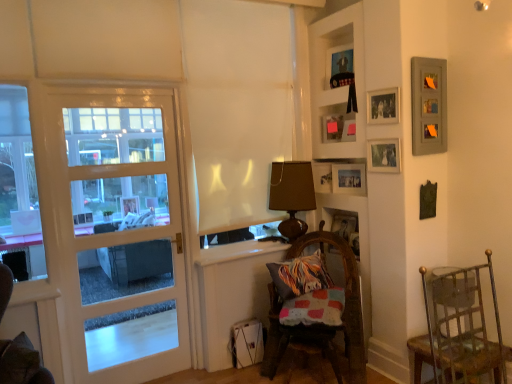
Question: Is brown fabric lampshade at center in front of or behind wooden photo frame at upper right, which is counted as the second picture frame, starting from the top, in the image?

Choices:
 (A) front
 (B) behind

Answer: (B)

Question: Is brown fabric lampshade at center wider or thinner than wooden photo frame at upper right, positioned as the 5th picture frame in bottom-to-top order?

Choices:
 (A) wide
 (B) thin

Answer: (A)

Question: Which object is positioned farthest from the wooden picture frame at center, the first picture frame positioned from the bottom?

Choices:
 (A) brown fabric lampshade at center
 (B) woven wood chair at lower center, which is the 1th chair in back-to-front order
 (C) matte wooden picture frame at upper center, which is counted as the 1th picture frame, starting from the top
 (D) white glossy door at left
 (E) wooden picture frame at upper right, which is counted as the 4th picture frame, starting from the top

Answer: (D)

Question: Based on their relative distances, which object is farther from the metallic silver picture frame at upper right, the 2th picture frame ordered from the bottom?

Choices:
 (A) white matte curtain at center
 (B) white glossy door at left
 (C) gray matte picture frame at upper right, the third picture frame when ordered from top to bottom
 (D) matte black couch at left
 (E) brown fabric lampshade at center

Answer: (D)